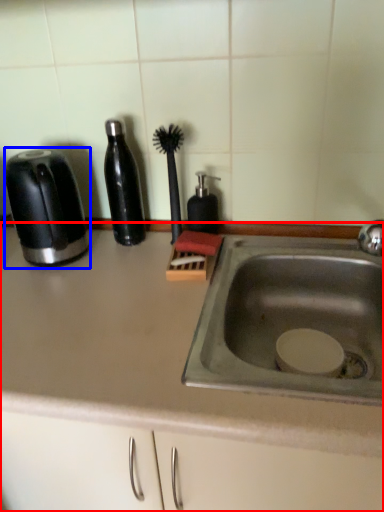
Question: Which object appears closest to the camera in this image, countertop (highlighted by a red box) or toaster (highlighted by a blue box)?

Choices:
 (A) countertop
 (B) toaster

Answer: (A)